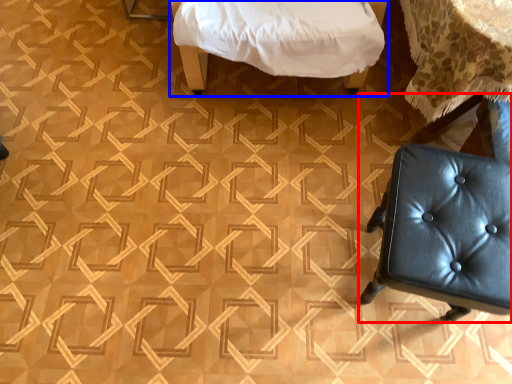
Question: Which object is closer to the camera taking this photo, chair (highlighted by a red box) or furniture (highlighted by a blue box)?

Choices:
 (A) chair
 (B) furniture

Answer: (A)